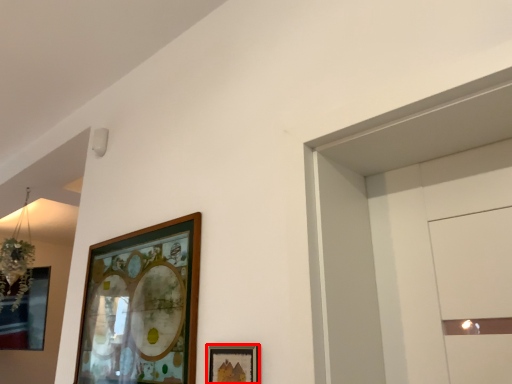
Question: From the image's perspective, what is the correct spatial positioning of picture frame (annotated by the red box) in reference to picture frame?

Choices:
 (A) above
 (B) below

Answer: (B)